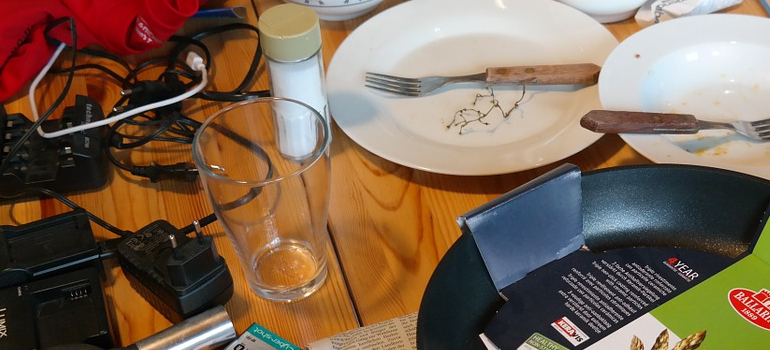
Find the location of `wooden table`. wooden table is located at coordinates (417, 211).